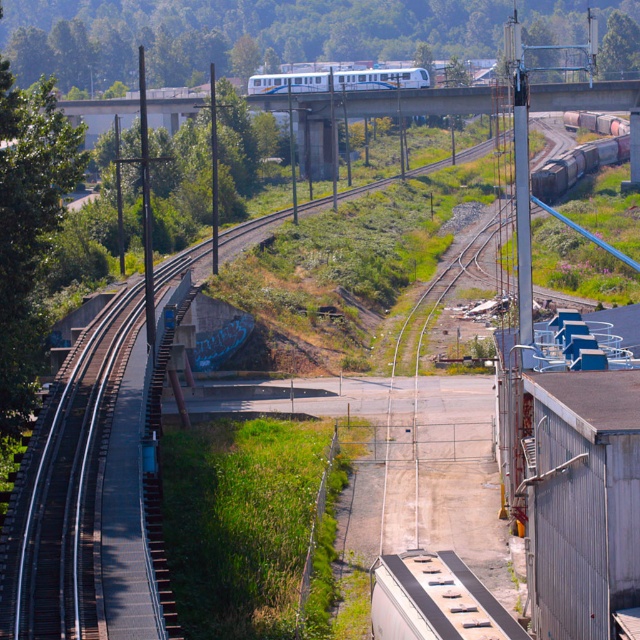
Question: Which of the following is the farthest from the observer?

Choices:
 (A) rusty metal train car at right
 (B) white glossy passenger train at upper center

Answer: (B)

Question: Can you confirm if rusty metal train car at right is bigger than white glossy passenger train at upper center?

Choices:
 (A) yes
 (B) no

Answer: (A)

Question: Which point is closer to the camera?

Choices:
 (A) click(342, 72)
 (B) click(545, 177)

Answer: (B)

Question: Can you confirm if rusty metal train car at right is positioned below white glossy passenger train at upper center?

Choices:
 (A) yes
 (B) no

Answer: (A)

Question: Can you confirm if rusty metal train car at right is positioned to the left of white glossy passenger train at upper center?

Choices:
 (A) yes
 (B) no

Answer: (B)

Question: Which point is farther to the camera?

Choices:
 (A) (554, 176)
 (B) (266, 84)

Answer: (B)